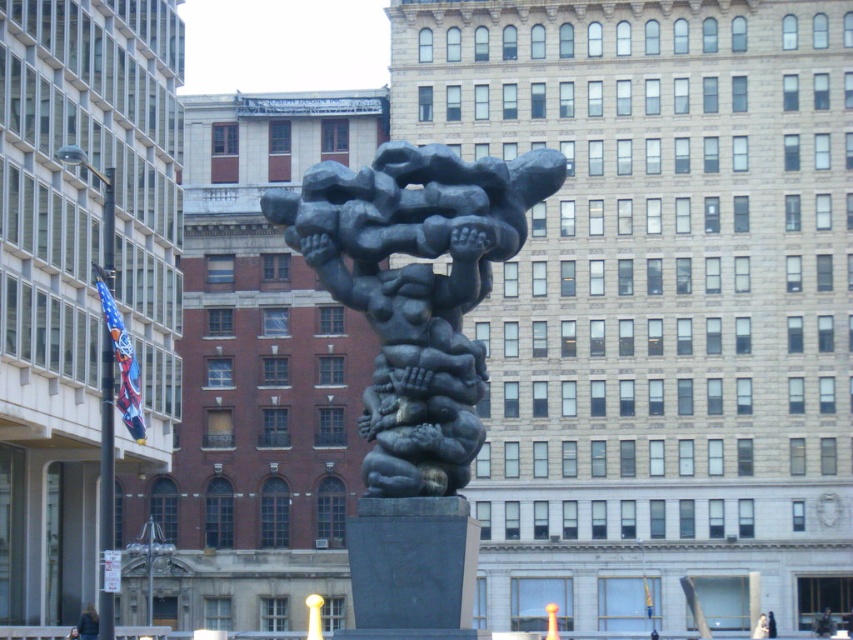
In the scene shown: Can you confirm if bronze sculpture at center is positioned to the left of dark brown hair at lower left?

No, bronze sculpture at center is not to the left of dark brown hair at lower left.

Does bronze sculpture at center have a greater height compared to dark brown hair at lower left?

Indeed, bronze sculpture at center has a greater height compared to dark brown hair at lower left.

Image resolution: width=853 pixels, height=640 pixels. What do you see at coordinates (416, 291) in the screenshot?
I see `bronze sculpture at center` at bounding box center [416, 291].

Identify the location of bronze sculpture at center. The width and height of the screenshot is (853, 640). (416, 291).